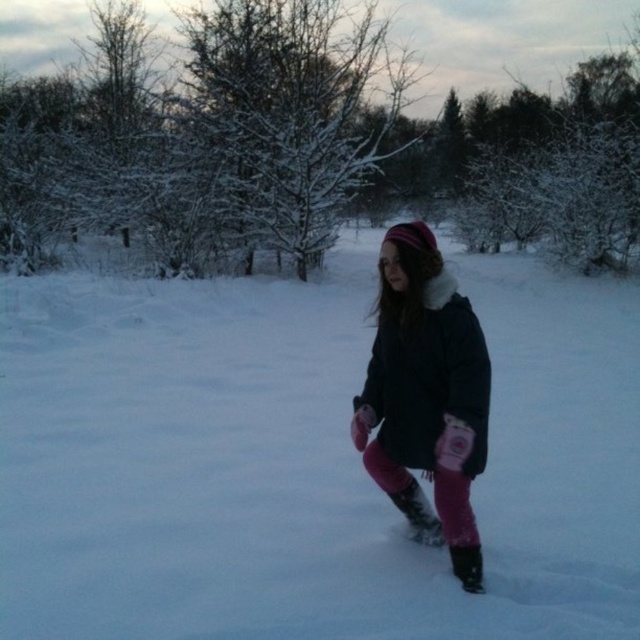
Question: Is white fluffy snow at center positioned at the back of pink fleece pants at center?

Choices:
 (A) yes
 (B) no

Answer: (A)

Question: Is the position of white fluffy snow at center less distant than that of pink fleece pants at center?

Choices:
 (A) yes
 (B) no

Answer: (B)

Question: Does white fluffy snow at center have a smaller size compared to black matte boot at lower center?

Choices:
 (A) yes
 (B) no

Answer: (B)

Question: Which point is farther to the camera?

Choices:
 (A) (228, 598)
 (B) (387, 392)
 (C) (472, 547)
 (D) (388, 493)

Answer: (D)

Question: Which point is closer to the camera taking this photo?

Choices:
 (A) click(x=289, y=300)
 (B) click(x=396, y=506)
 (C) click(x=461, y=554)

Answer: (C)

Question: Which of the following is the farthest from the observer?

Choices:
 (A) black matte boot at lower center
 (B) pink fleece pants at center
 (C) matte black boot at center

Answer: (C)